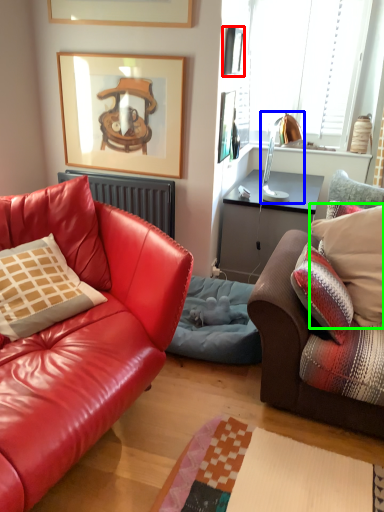
Question: Which object is positioned farthest from picture frame (highlighted by a red box)? Select from lamp (highlighted by a blue box) and pillow (highlighted by a green box).

Choices:
 (A) lamp
 (B) pillow

Answer: (B)